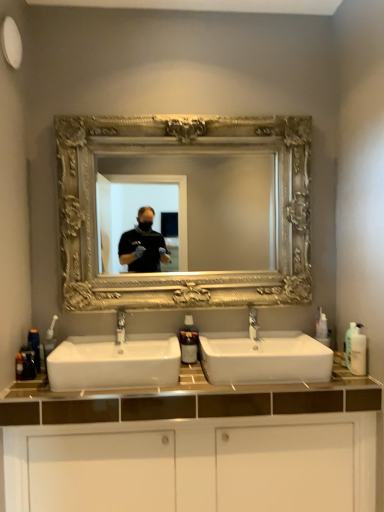
Question: Which direction should I rotate to look at white ceramic sink at center, marked as the second sink in a left-to-right arrangement, — up or down?

Choices:
 (A) down
 (B) up

Answer: (A)

Question: Can you confirm if matte silver faucet at center, which is the 1th tap in left-to-right order, is shorter than translucent plastic bottle at lower left, placed as the 2th toiletry when sorted from left to right?

Choices:
 (A) yes
 (B) no

Answer: (B)

Question: Considering the relative positions of matte silver faucet at center, acting as the 2th tap starting from the right, and translucent plastic bottle at lower left, placed as the 2th toiletry when sorted from left to right, in the image provided, is matte silver faucet at center, acting as the 2th tap starting from the right, behind translucent plastic bottle at lower left, placed as the 2th toiletry when sorted from left to right,?

Choices:
 (A) no
 (B) yes

Answer: (B)

Question: Does matte silver faucet at center, which is the 1th tap in left-to-right order, appear on the right side of translucent plastic bottle at lower left, placed as the 2th toiletry when sorted from left to right?

Choices:
 (A) yes
 (B) no

Answer: (A)

Question: Is matte silver faucet at center, acting as the 2th tap starting from the right, positioned in front of translucent plastic bottle at lower left, placed as the 2th toiletry when sorted from left to right?

Choices:
 (A) no
 (B) yes

Answer: (A)

Question: Is matte silver faucet at center, which is the 1th tap in left-to-right order, at the left side of translucent plastic bottle at lower left, placed as the 2th toiletry when sorted from left to right?

Choices:
 (A) no
 (B) yes

Answer: (A)

Question: Are matte silver faucet at center, acting as the 2th tap starting from the right, and translucent plastic bottle at lower left, placed as the 2th toiletry when sorted from left to right, beside each other?

Choices:
 (A) yes
 (B) no

Answer: (B)

Question: Considering the relative positions of white glossy cabinet at lower center and translucent plastic bottle at lower left, the second toiletry when ordered from right to left, in the image provided, is white glossy cabinet at lower center in front of translucent plastic bottle at lower left, the second toiletry when ordered from right to left,?

Choices:
 (A) no
 (B) yes

Answer: (B)

Question: Can you confirm if white glossy cabinet at lower center is thinner than translucent plastic bottle at lower left, placed as the 2th toiletry when sorted from left to right?

Choices:
 (A) no
 (B) yes

Answer: (A)

Question: Can translucent plastic bottle at lower left, placed as the 2th toiletry when sorted from left to right, be found inside white glossy cabinet at lower center?

Choices:
 (A) no
 (B) yes

Answer: (A)

Question: Does white glossy cabinet at lower center have a lesser height compared to translucent plastic bottle at lower left, placed as the 2th toiletry when sorted from left to right?

Choices:
 (A) yes
 (B) no

Answer: (B)

Question: Does white glossy cabinet at lower center come behind translucent plastic bottle at lower left, placed as the 2th toiletry when sorted from left to right?

Choices:
 (A) yes
 (B) no

Answer: (B)

Question: Is white glossy cabinet at lower center bigger than translucent plastic bottle at lower left, the second toiletry when ordered from right to left?

Choices:
 (A) no
 (B) yes

Answer: (B)

Question: Is gold ornate mirror at center at the left side of white plastic bottle at right, arranged as the 3th toiletry when viewed from the left?

Choices:
 (A) yes
 (B) no

Answer: (A)